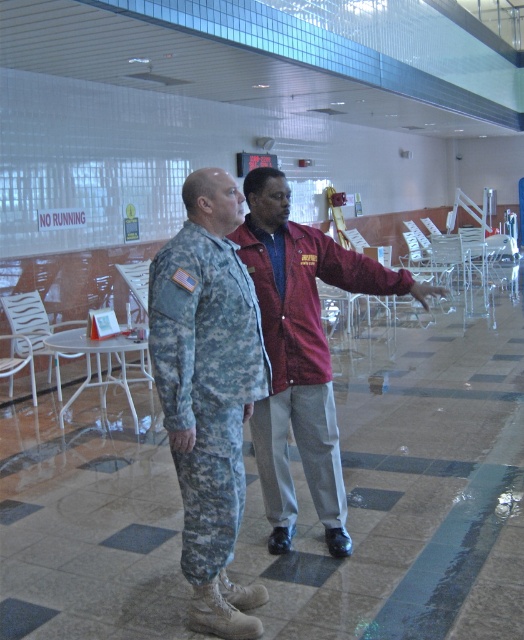
Between point (248, 285) and point (300, 449), which one is positioned behind?

Positioned behind is point (300, 449).

Is camouflage fabric uniform at center to the left of maroon fabric jacket at center from the viewer's perspective?

Correct, you'll find camouflage fabric uniform at center to the left of maroon fabric jacket at center.

What are the coordinates of `camouflage fabric uniform at center` in the screenshot? It's located at (205, 384).

Is point (319, 236) farther from viewer compared to point (15, 346)?

No, it is in front of (15, 346).

Find the location of `maroon fabric jacket at center`. maroon fabric jacket at center is located at coordinates (302, 360).

Is point (223, 400) in front of point (49, 362)?

Yes, it is.

From the picture: Does camouflage fabric uniform at center have a lesser height compared to white plastic chair at left?

Incorrect, camouflage fabric uniform at center's height does not fall short of white plastic chair at left's.

Identify the location of camouflage fabric uniform at center. Image resolution: width=524 pixels, height=640 pixels. (205, 384).

You are a GUI agent. You are given a task and a screenshot of the screen. Output one action in this format:
    pyautogui.click(x=<x>, y=<y>)
    Task: Click on the camouflage fabric uniform at center
    
    Given the screenshot: What is the action you would take?
    pos(205,384)